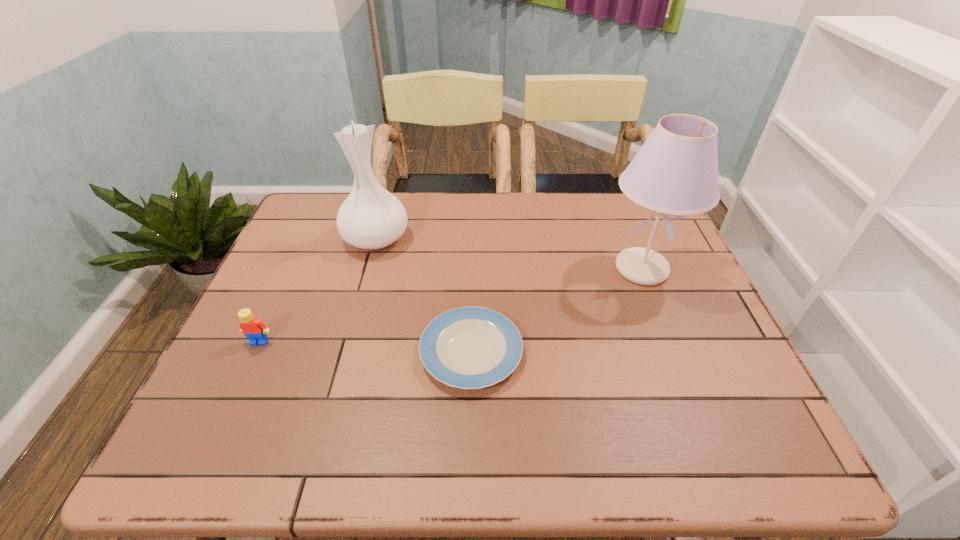
Locate an element on the screen. vacant region between the rightmost object and the second tallest object is located at coordinates (509, 254).

Find the location of a particular element. vacant space that is in between the Lego and the shortest object is located at coordinates (365, 347).

I want to click on empty space between the third object from right to left and the second object from right to left, so click(x=423, y=295).

What are the coordinates of `vacant area that lies between the Lego and the lampshade` in the screenshot? It's located at (450, 305).

This screenshot has height=540, width=960. In order to click on empty space between the third object from right to left and the lampshade in this screenshot , I will do `click(509, 254)`.

Locate an element on the screen. vacant space that is in between the leftmost object and the third shortest object is located at coordinates pyautogui.click(x=318, y=290).

The height and width of the screenshot is (540, 960). I want to click on free area in between the tallest object and the Lego, so click(x=450, y=305).

Where is `free space between the Lego and the shortest object`? Image resolution: width=960 pixels, height=540 pixels. free space between the Lego and the shortest object is located at coordinates (365, 347).

Locate an element on the screen. The height and width of the screenshot is (540, 960). free space between the vase and the third tallest object is located at coordinates (318, 290).

Locate an element on the screen. The width and height of the screenshot is (960, 540). free spot between the second tallest object and the rightmost object is located at coordinates (509, 254).